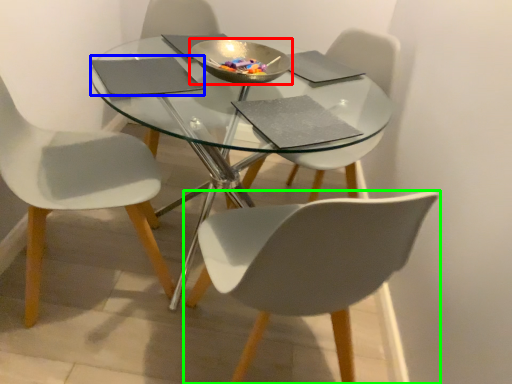
Question: Based on their relative distances, which object is farther from bowl (highlighted by a red box)? Choose from pad (highlighted by a blue box) and chair (highlighted by a green box).

Choices:
 (A) pad
 (B) chair

Answer: (B)